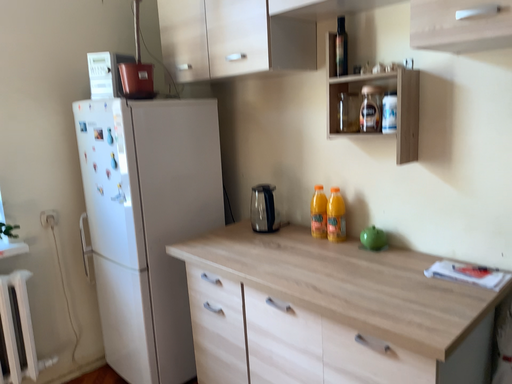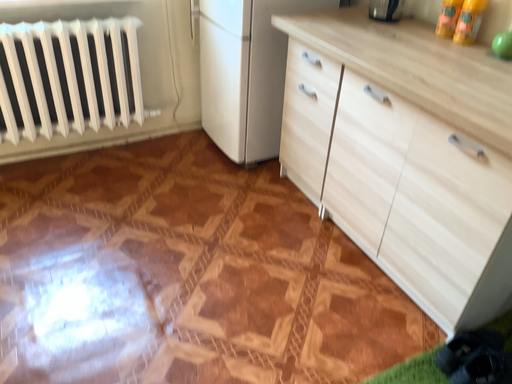
Question: How did the camera likely rotate when shooting the video?

Choices:
 (A) rotated left
 (B) rotated right

Answer: (A)